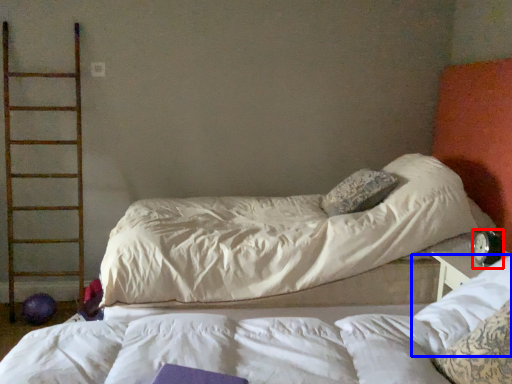
Question: Which object is further to the camera taking this photo, alarm clock (highlighted by a red box) or pillow (highlighted by a blue box)?

Choices:
 (A) alarm clock
 (B) pillow

Answer: (A)